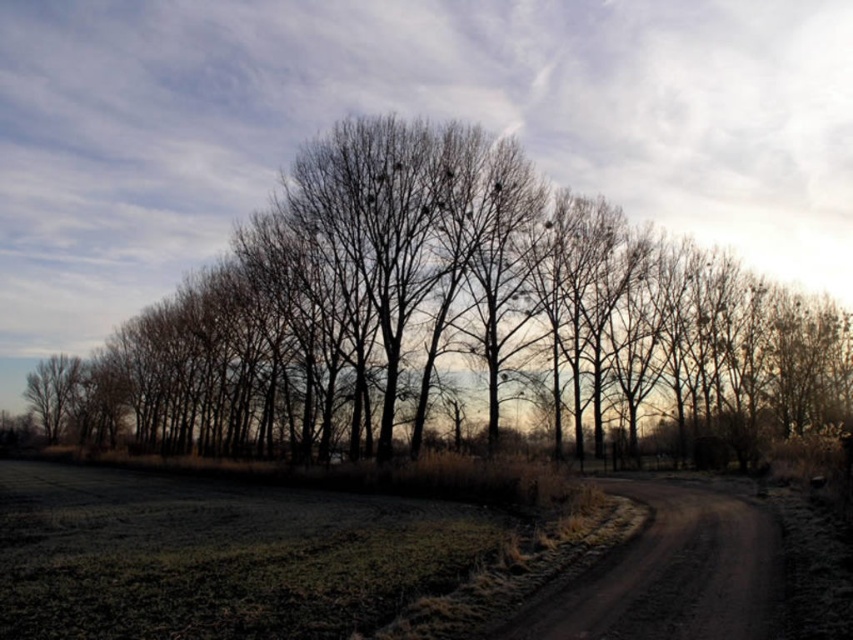
Question: From the image, what is the correct spatial relationship of brown bark tree at center in relation to dusty brown dirt track at lower right?

Choices:
 (A) above
 (B) below

Answer: (A)

Question: Is brown bark tree at center to the left of dusty brown dirt track at lower right from the viewer's perspective?

Choices:
 (A) no
 (B) yes

Answer: (B)

Question: Which object is farther from the camera taking this photo?

Choices:
 (A) dusty brown dirt track at lower right
 (B) brown bark tree at center

Answer: (B)

Question: Can you confirm if brown bark tree at center is positioned below dusty brown dirt track at lower right?

Choices:
 (A) no
 (B) yes

Answer: (A)